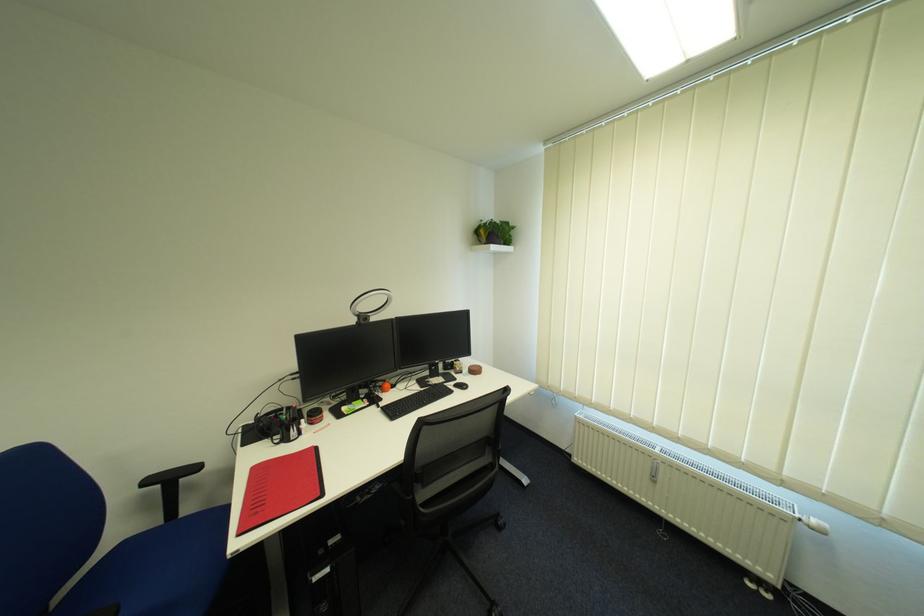
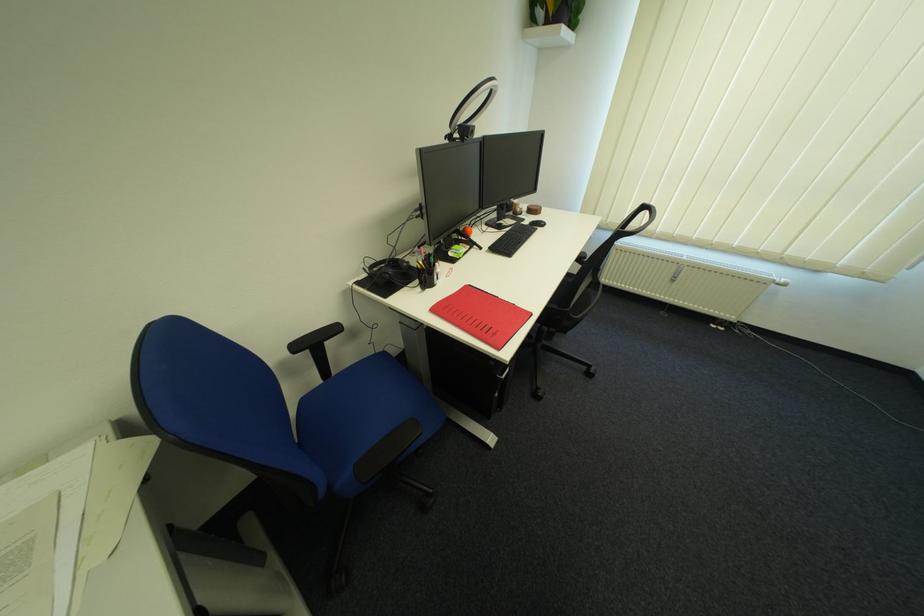
In the second image, find the point that corresponds to point (465, 379) in the first image.

(532, 221)